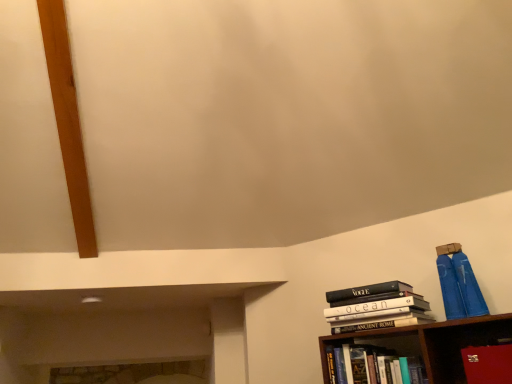
Question: Considering the positions of hardcover book at lower right, which is the first book in bottom-to-top order, and hardcover books at right, placed as the second book when sorted from bottom to top, in the image, is hardcover book at lower right, which is the first book in bottom-to-top order, taller or shorter than hardcover books at right, placed as the second book when sorted from bottom to top,?

Choices:
 (A) short
 (B) tall

Answer: (A)

Question: Would you say hardcover book at lower right, which is the 2th book in top-to-bottom order, is inside or outside hardcover books at right, placed as the first book when sorted from top to bottom?

Choices:
 (A) outside
 (B) inside

Answer: (A)

Question: Considering the real-world distances, which object is farthest from the hardcover book at lower right, which is the first book in bottom-to-top order?

Choices:
 (A) hardcover books at right, placed as the second book when sorted from bottom to top
 (B) red leather book at lower right

Answer: (B)

Question: Which object is positioned closest to the hardcover books at right, placed as the first book when sorted from top to bottom?

Choices:
 (A) hardcover book at lower right, which is the 2th book in top-to-bottom order
 (B) red leather book at lower right

Answer: (A)